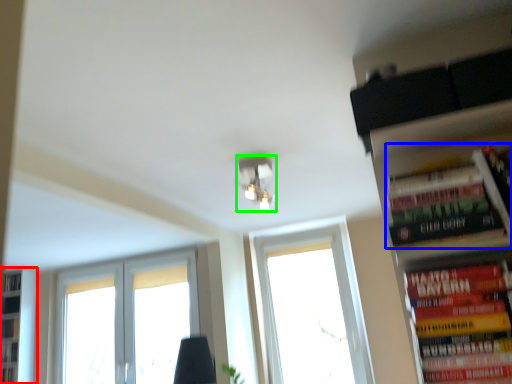
Question: Which object is positioned closest to bookshelf (highlighted by a red box)? Select from book (highlighted by a blue box) and light fixture (highlighted by a green box).

Choices:
 (A) book
 (B) light fixture

Answer: (B)